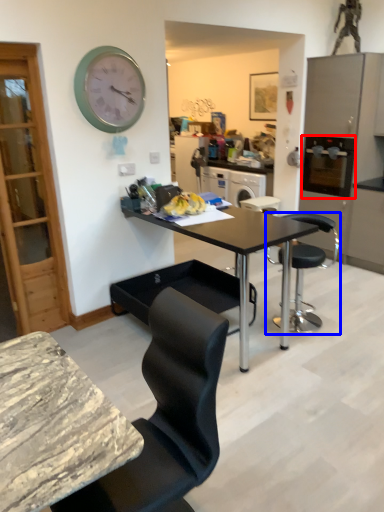
Question: Which object appears farthest to the camera in this image, appliance (highlighted by a red box) or chair (highlighted by a blue box)?

Choices:
 (A) appliance
 (B) chair

Answer: (A)